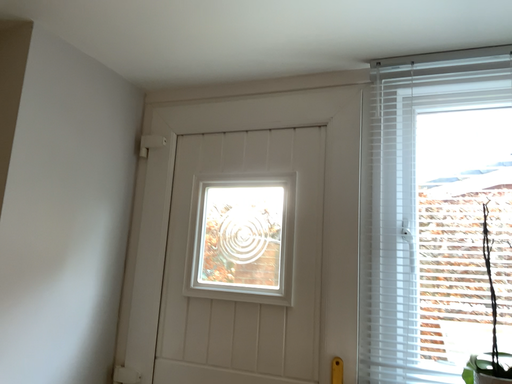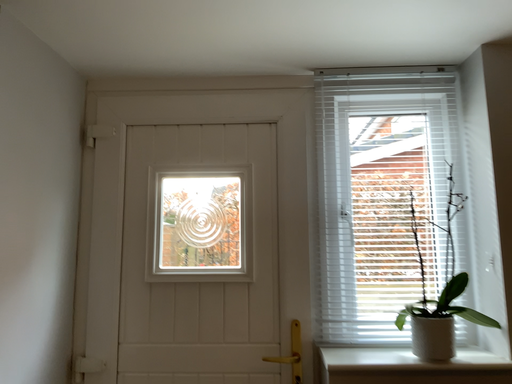
Question: How did the camera likely rotate when shooting the video?

Choices:
 (A) rotated right
 (B) rotated left

Answer: (A)